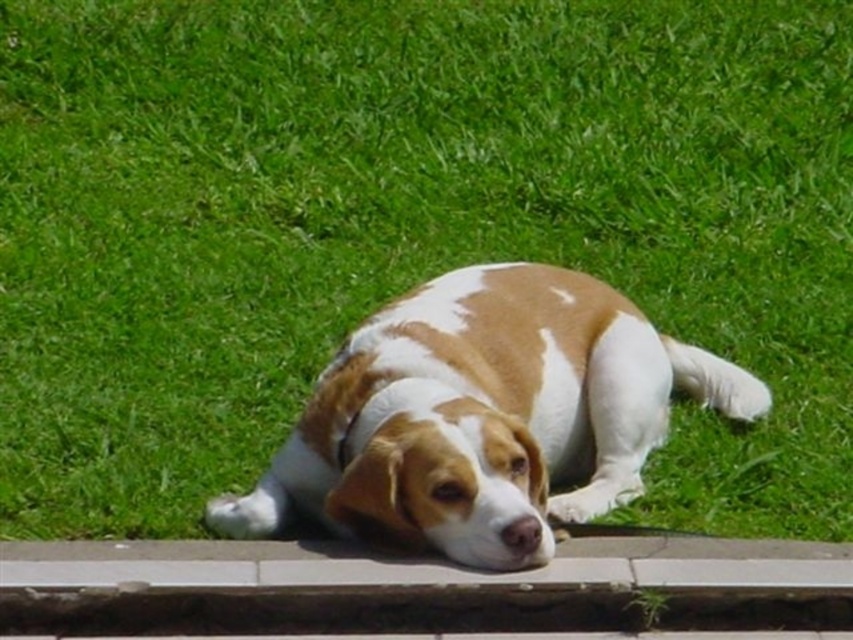
In the scene shown: Can you confirm if brown and white fur dog at center is positioned to the right of gray concrete curb at lower center?

Indeed, brown and white fur dog at center is positioned on the right side of gray concrete curb at lower center.

Which is more to the right, brown and white fur dog at center or gray concrete curb at lower center?

Positioned to the right is brown and white fur dog at center.

Between point (669, 384) and point (108, 589), which one is positioned in front?

Positioned in front is point (108, 589).

Identify the location of brown and white fur dog at center. This screenshot has width=853, height=640. (485, 417).